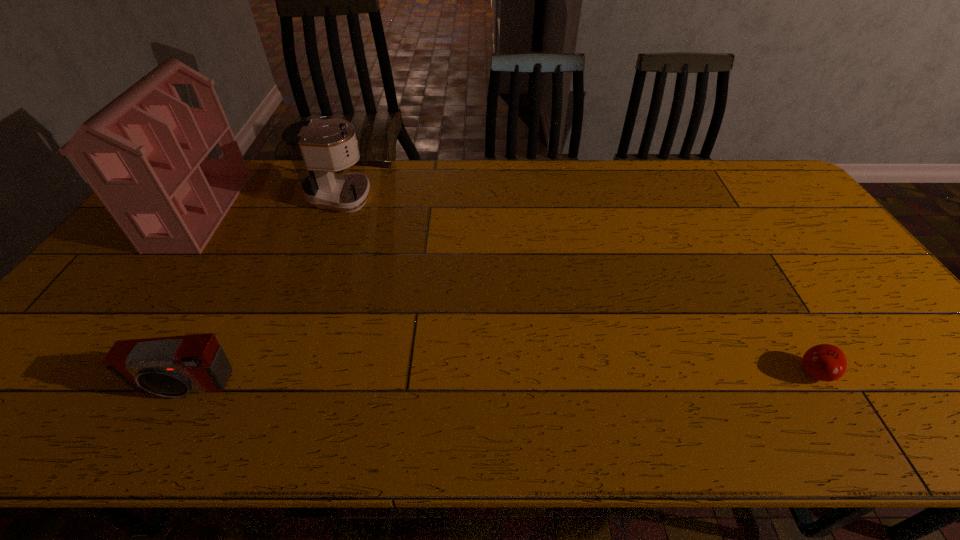
I want to click on free space that satisfies the following two spatial constraints: 1. on the back side of the shortest object; 2. on the front-facing side of the tallest object, so click(x=718, y=211).

Locate an element on the screen. The height and width of the screenshot is (540, 960). vacant space that satisfies the following two spatial constraints: 1. on the front-facing side of the third shortest object; 2. on the back side of the rightmost object is located at coordinates (291, 372).

You are a GUI agent. You are given a task and a screenshot of the screen. Output one action in this format:
    pyautogui.click(x=<x>, y=<y>)
    Task: Click on the blank space that satisfies the following two spatial constraints: 1. on the front-facing side of the shortest object; 2. on the left side of the coffee maker
    The height and width of the screenshot is (540, 960).
    Given the screenshot: What is the action you would take?
    pyautogui.click(x=291, y=372)

This screenshot has width=960, height=540. In order to click on free location that satisfies the following two spatial constraints: 1. on the front-facing side of the coffee maker; 2. on the front-facing side of the camera in this screenshot , I will do `click(286, 387)`.

Image resolution: width=960 pixels, height=540 pixels. Find the location of `blank area in the image that satisfies the following two spatial constraints: 1. on the front-facing side of the coffee maker; 2. on the front-facing side of the camera`. blank area in the image that satisfies the following two spatial constraints: 1. on the front-facing side of the coffee maker; 2. on the front-facing side of the camera is located at coordinates (286, 387).

Where is `vacant region that satisfies the following two spatial constraints: 1. on the front-facing side of the coffee maker; 2. on the left side of the apple`? The height and width of the screenshot is (540, 960). vacant region that satisfies the following two spatial constraints: 1. on the front-facing side of the coffee maker; 2. on the left side of the apple is located at coordinates (291, 372).

Image resolution: width=960 pixels, height=540 pixels. I want to click on free spot that satisfies the following two spatial constraints: 1. on the front-facing side of the coffee maker; 2. on the left side of the apple, so click(291, 372).

Locate an element on the screen. Image resolution: width=960 pixels, height=540 pixels. vacant space that satisfies the following two spatial constraints: 1. on the front-facing side of the dollhouse; 2. on the right side of the shortest object is located at coordinates (85, 372).

Identify the location of vacant space that satisfies the following two spatial constraints: 1. on the front-facing side of the rightmost object; 2. on the left side of the second tallest object. This screenshot has width=960, height=540. (291, 372).

The width and height of the screenshot is (960, 540). I want to click on blank area in the image that satisfies the following two spatial constraints: 1. on the front-facing side of the leftmost object; 2. on the left side of the rightmost object, so click(85, 372).